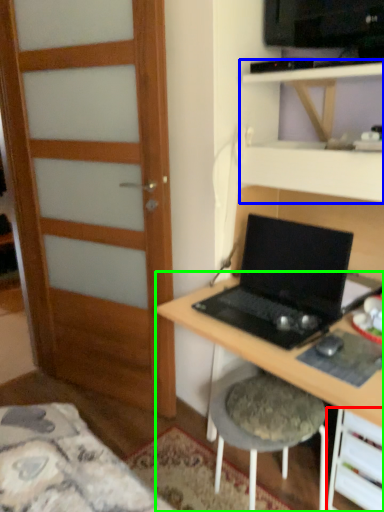
Question: Based on their relative distances, which object is farther from drawer (highlighted by a red box)? Choose from shelf (highlighted by a blue box) and desk (highlighted by a green box).

Choices:
 (A) shelf
 (B) desk

Answer: (A)